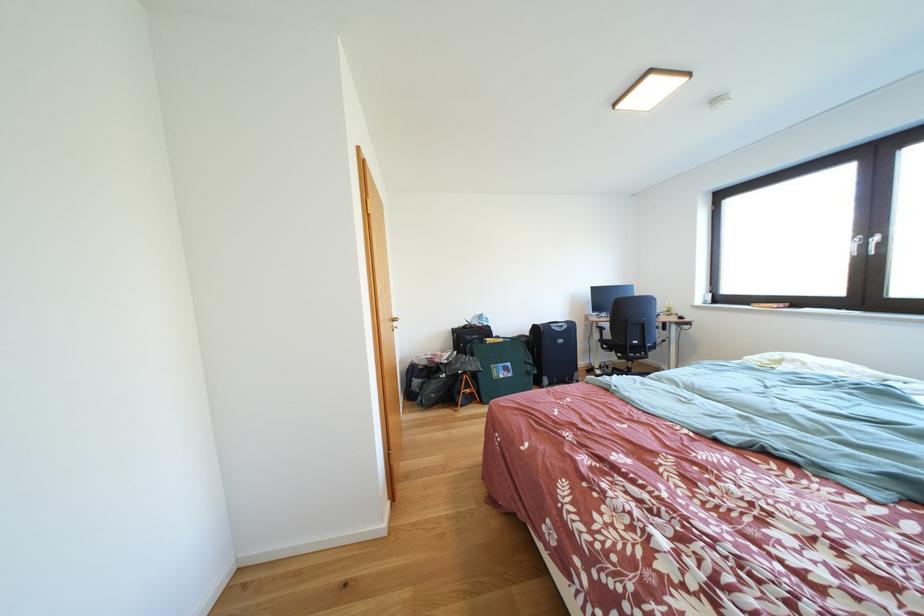
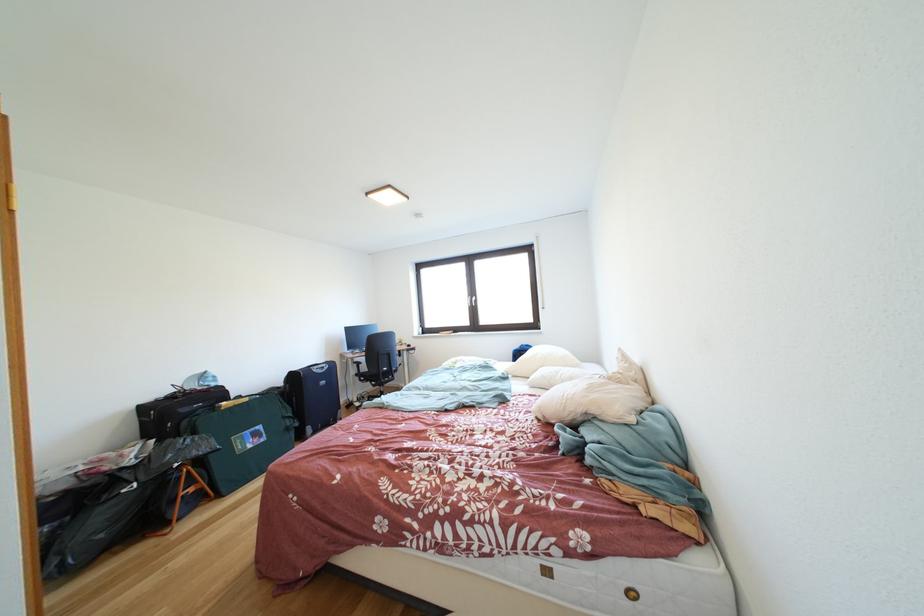
The point at (543,377) is marked in the first image. Where is the corresponding point in the second image?

(306, 429)